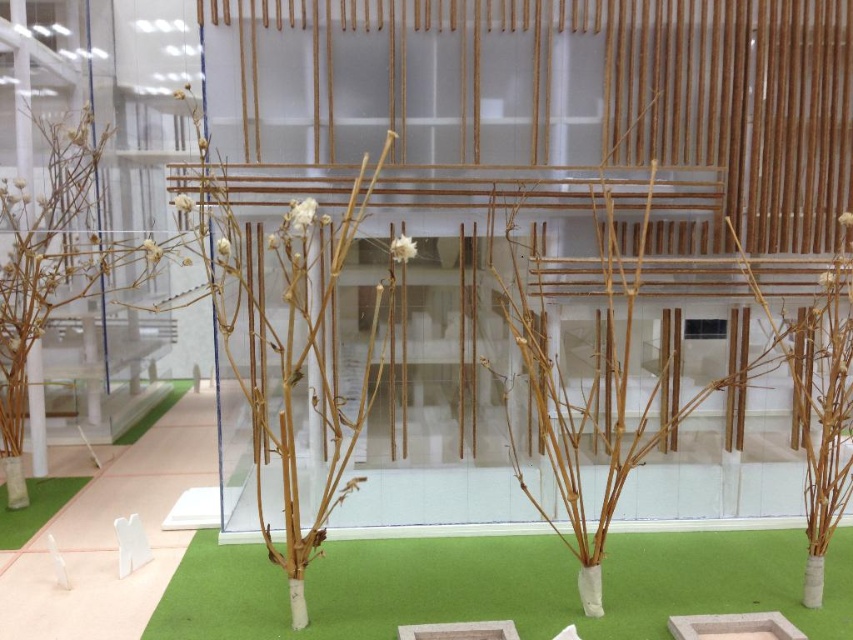
Question: Which object is the farthest from the brown matte branches at left?

Choices:
 (A) green artificial grass at center
 (B) brown matte tree at center
 (C) green artificial grass at lower left

Answer: (A)

Question: Does brown matte branches at left appear over green artificial grass at lower left?

Choices:
 (A) no
 (B) yes

Answer: (B)

Question: Which point is closer to the camera?

Choices:
 (A) (334, 433)
 (B) (22, 316)
 (C) (257, 580)

Answer: (A)

Question: Can you confirm if green artificial grass at lower left is positioned below green artificial grass at center?

Choices:
 (A) yes
 (B) no

Answer: (A)

Question: Which point appears farthest from the camera in this image?

Choices:
 (A) (161, 401)
 (B) (254, 324)
 (C) (91, 228)

Answer: (A)

Question: Does brown matte tree at center have a smaller size compared to green artificial grass at lower left?

Choices:
 (A) no
 (B) yes

Answer: (A)